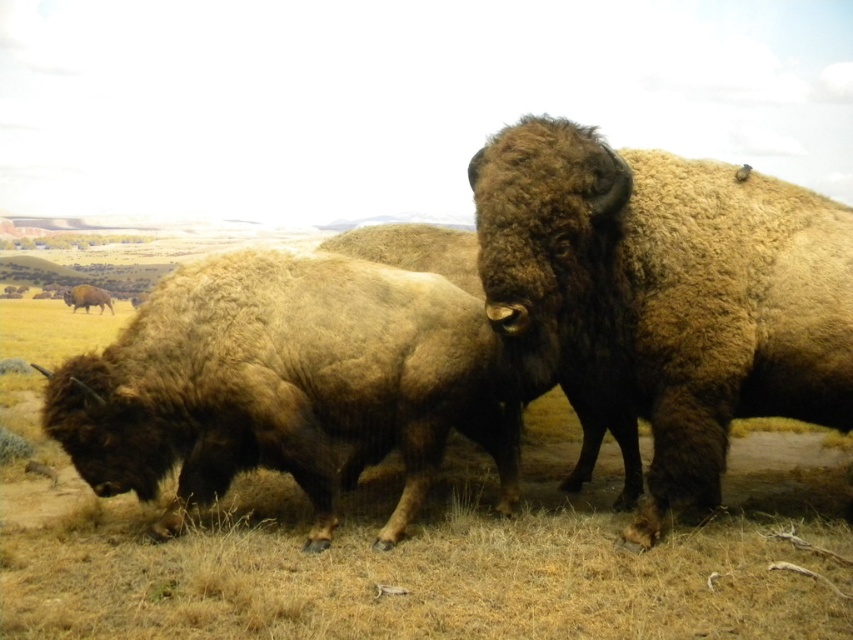
Question: Is brown fuzzy bison at center to the left of brown fuzzy bison at lower left from the viewer's perspective?

Choices:
 (A) yes
 (B) no

Answer: (B)

Question: Which of the following is the closest to the observer?

Choices:
 (A) brown fuzzy bison at lower left
 (B) brown fuzzy bison at center

Answer: (B)

Question: Among these points, which one is farthest from the camera?

Choices:
 (A) [x=103, y=296]
 (B) [x=589, y=164]

Answer: (A)

Question: Considering the relative positions of brown fuzzy bison at center and brown fuzzy bison at lower left in the image provided, where is brown fuzzy bison at center located with respect to brown fuzzy bison at lower left?

Choices:
 (A) above
 (B) below

Answer: (B)

Question: Which point is closer to the camera?

Choices:
 (A) brown fuzzy bison at lower left
 (B) brown fuzzy bison at center

Answer: (B)

Question: Does brown fuzzy bison at center have a smaller size compared to brown fuzzy bison at lower left?

Choices:
 (A) no
 (B) yes

Answer: (A)